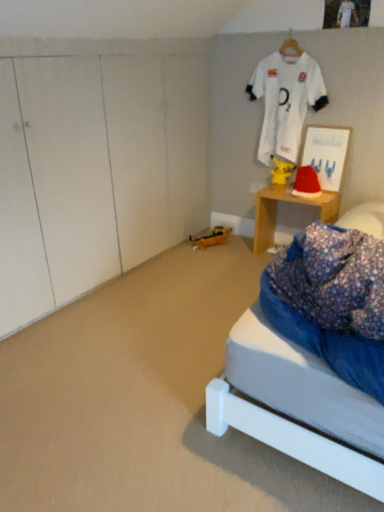
Question: From a real-world perspective, is wooden desk at right located beneath white jersey at upper center?

Choices:
 (A) yes
 (B) no

Answer: (A)

Question: Could you tell me if wooden desk at right is facing white jersey at upper center?

Choices:
 (A) yes
 (B) no

Answer: (B)

Question: Considering the relative sizes of wooden desk at right and white jersey at upper center in the image provided, is wooden desk at right taller than white jersey at upper center?

Choices:
 (A) yes
 (B) no

Answer: (B)

Question: Is white jersey at upper center surrounded by wooden desk at right?

Choices:
 (A) yes
 (B) no

Answer: (B)

Question: Is wooden desk at right at the left side of white jersey at upper center?

Choices:
 (A) yes
 (B) no

Answer: (B)

Question: Is wooden desk at right bigger or smaller than red velvet santa hat at right?

Choices:
 (A) small
 (B) big

Answer: (B)

Question: From a real-world perspective, is wooden desk at right above or below red velvet santa hat at right?

Choices:
 (A) below
 (B) above

Answer: (A)

Question: Based on their positions, is wooden desk at right located to the left or right of red velvet santa hat at right?

Choices:
 (A) right
 (B) left

Answer: (B)

Question: From the image's perspective, is wooden desk at right above or below red velvet santa hat at right?

Choices:
 (A) below
 (B) above

Answer: (A)

Question: Does point (301, 185) appear closer or farther from the camera than point (324, 130)?

Choices:
 (A) closer
 (B) farther

Answer: (B)

Question: Is red velvet santa hat at right inside or outside of matte white picture frame at upper right?

Choices:
 (A) inside
 (B) outside

Answer: (B)

Question: In terms of height, does red velvet santa hat at right look taller or shorter compared to matte white picture frame at upper right?

Choices:
 (A) short
 (B) tall

Answer: (A)

Question: In the image, is red velvet santa hat at right on the left side or the right side of matte white picture frame at upper right?

Choices:
 (A) right
 (B) left

Answer: (B)

Question: Is red velvet santa hat at right wider or thinner than yellow matte pikachu at center?

Choices:
 (A) wide
 (B) thin

Answer: (A)

Question: Considering their positions, is red velvet santa hat at right located in front of or behind yellow matte pikachu at center?

Choices:
 (A) behind
 (B) front

Answer: (B)